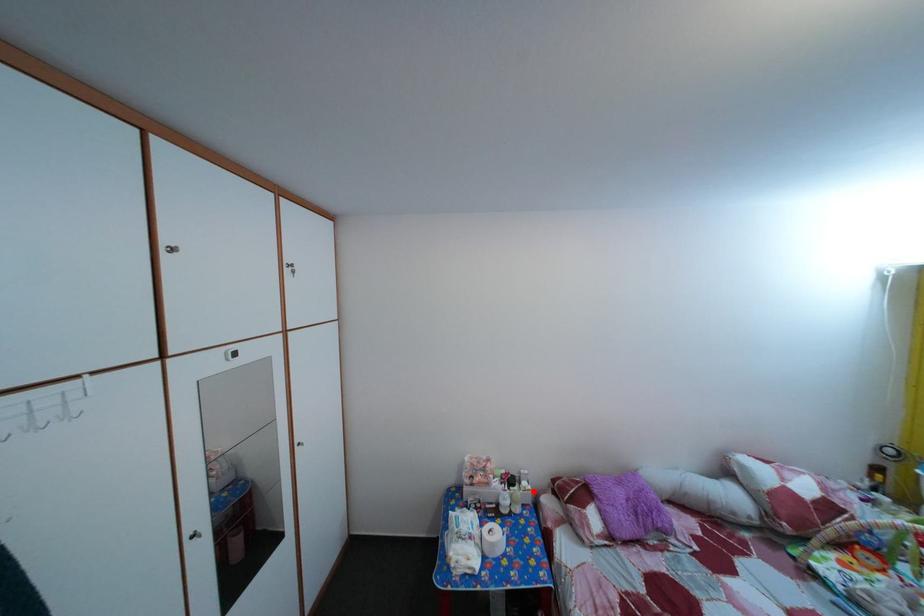
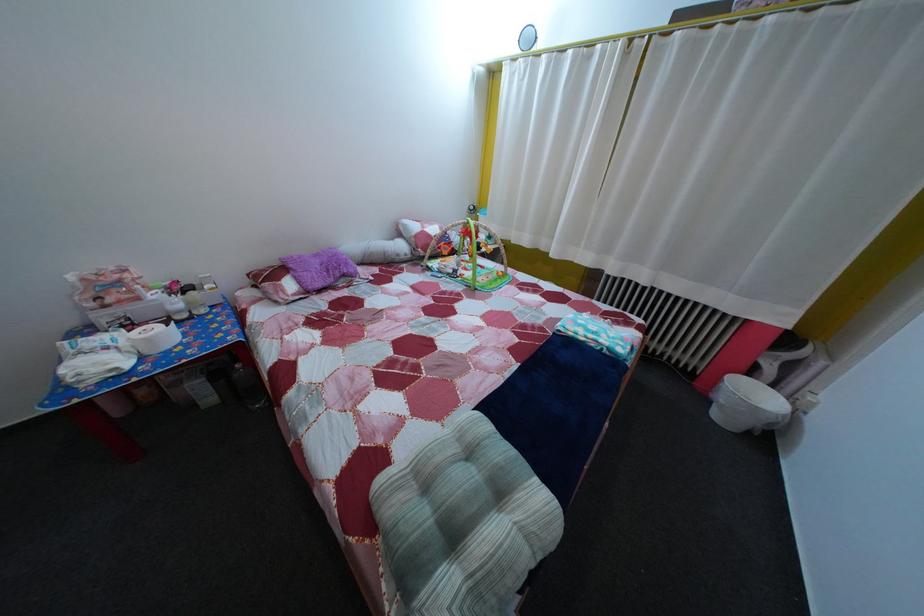
Locate, in the second image, the point that corresponds to the highlighted location in the first image.

(216, 294)